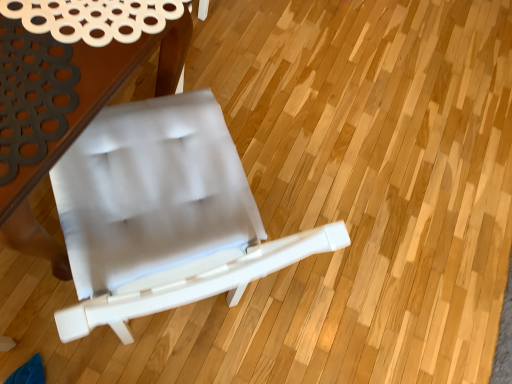
Question: Choose the correct answer: Is white fabric chair at center inside white fabric table at upper left or outside it?

Choices:
 (A) outside
 (B) inside

Answer: (A)

Question: Considering the positions of white fabric chair at center and white fabric table at upper left in the image, is white fabric chair at center wider or thinner than white fabric table at upper left?

Choices:
 (A) thin
 (B) wide

Answer: (A)

Question: Is white fabric chair at center taller or shorter than white fabric table at upper left?

Choices:
 (A) short
 (B) tall

Answer: (B)

Question: In terms of width, does white fabric table at upper left look wider or thinner when compared to white fabric chair at center?

Choices:
 (A) wide
 (B) thin

Answer: (A)

Question: From the image's perspective, relative to white fabric chair at center, is white fabric table at upper left above or below?

Choices:
 (A) above
 (B) below

Answer: (A)

Question: Would you say white fabric table at upper left is to the left or to the right of white fabric chair at center in the picture?

Choices:
 (A) left
 (B) right

Answer: (A)

Question: Based on their sizes in the image, would you say white fabric table at upper left is bigger or smaller than white fabric chair at center?

Choices:
 (A) big
 (B) small

Answer: (A)